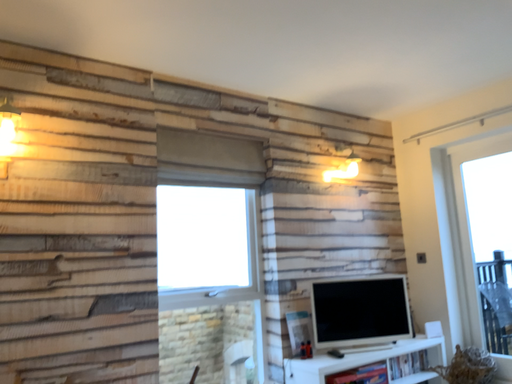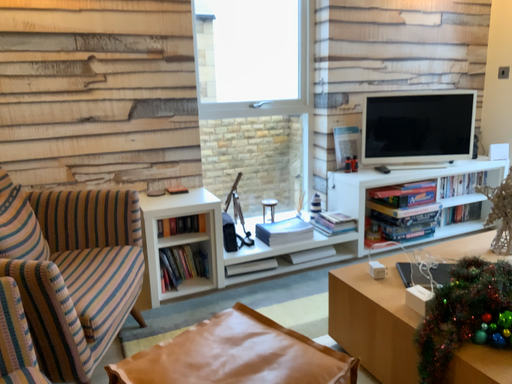
Question: Which way did the camera rotate in the video?

Choices:
 (A) rotated downward
 (B) rotated upward

Answer: (A)